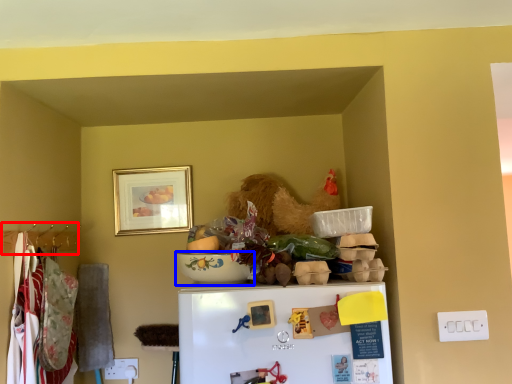
Question: Which object is closer to the camera taking this photo, hanger (highlighted by a red box) or bowl (highlighted by a blue box)?

Choices:
 (A) hanger
 (B) bowl

Answer: (B)